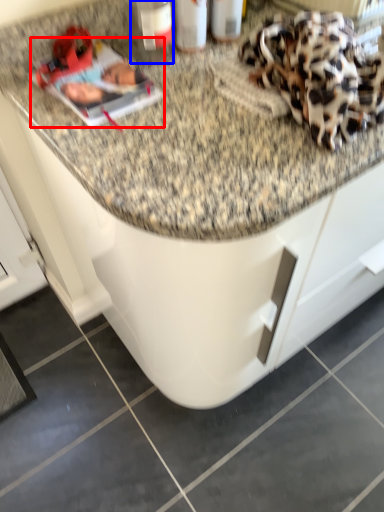
Question: Which object appears farthest to the camera in this image, magazine (highlighted by a red box) or bottle (highlighted by a blue box)?

Choices:
 (A) magazine
 (B) bottle

Answer: (B)